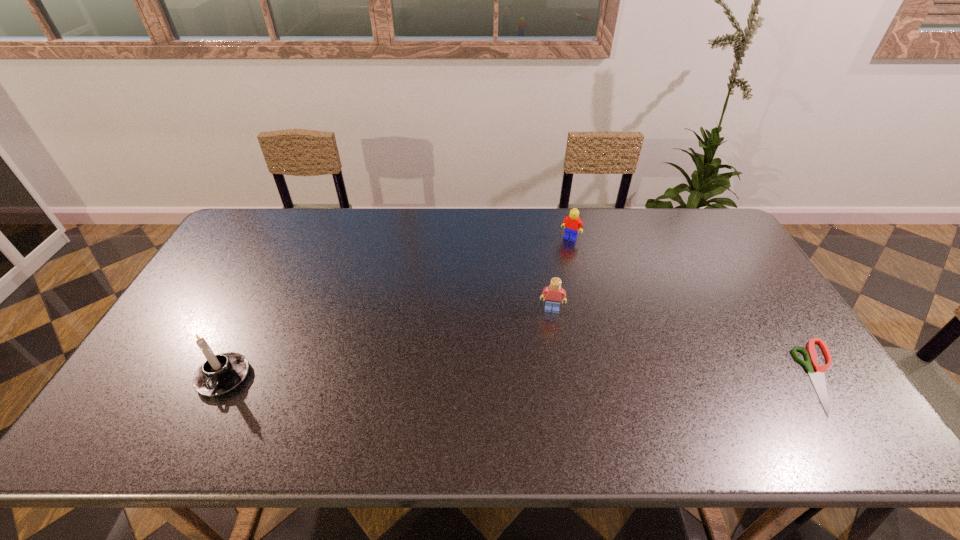
This screenshot has width=960, height=540. What are the coordinates of `blank space located 0.280m on the front-facing side of the third nearest object` in the screenshot? It's located at (541, 398).

The image size is (960, 540). I want to click on vacant point located 0.290m on the front-facing side of the third nearest object, so [x=541, y=401].

This screenshot has height=540, width=960. I want to click on vacant space located 0.250m on the front-facing side of the right Lego, so click(x=539, y=287).

Where is `vacant space located on the front-facing side of the right Lego`? vacant space located on the front-facing side of the right Lego is located at coordinates (553, 264).

Locate an element on the screen. vacant space located 0.260m on the front-facing side of the right Lego is located at coordinates (537, 289).

You are a GUI agent. You are given a task and a screenshot of the screen. Output one action in this format:
    pyautogui.click(x=<x>, y=<y>)
    Task: Click on the object located at the far edge
    The height and width of the screenshot is (540, 960).
    Given the screenshot: What is the action you would take?
    pyautogui.click(x=571, y=223)

I want to click on candle holder located in the near edge section of the desktop, so click(x=221, y=373).

You are a GUI agent. You are given a task and a screenshot of the screen. Output one action in this format:
    pyautogui.click(x=<x>, y=<y>)
    Task: Click on the scissors situated at the near edge
    
    Given the screenshot: What is the action you would take?
    pyautogui.click(x=818, y=379)

This screenshot has width=960, height=540. Find the location of `object that is at the left edge`. object that is at the left edge is located at coordinates (221, 373).

Where is `object present at the right edge`? object present at the right edge is located at coordinates (818, 379).